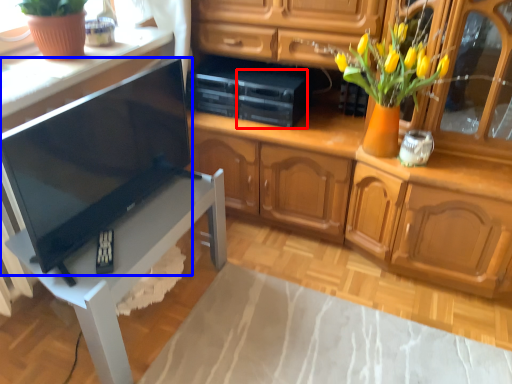
Question: Which point is further to the camera, appliance (highlighted by a red box) or television (highlighted by a blue box)?

Choices:
 (A) appliance
 (B) television

Answer: (A)